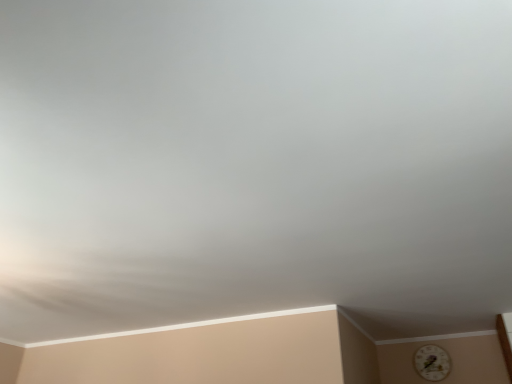
Measure the distance between point (447, 361) and camera.

The distance of point (447, 361) from camera is 13.53 feet.

Describe the element at coordinates (432, 362) in the screenshot. This screenshot has width=512, height=384. I see `white glossy wall clock at lower right` at that location.

Image resolution: width=512 pixels, height=384 pixels. What are the coordinates of `white glossy wall clock at lower right` in the screenshot? It's located at (432, 362).

The width and height of the screenshot is (512, 384). In order to click on white glossy wall clock at lower right in this screenshot , I will do `click(432, 362)`.